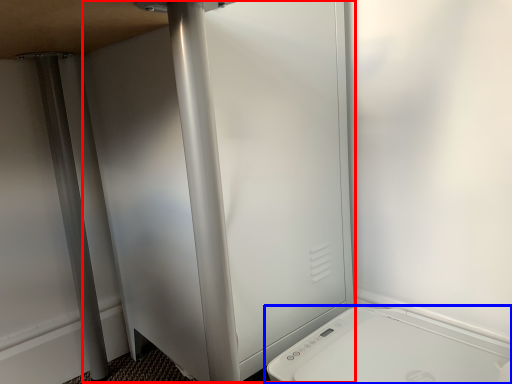
Question: Which object is further to the camera taking this photo, screen door (highlighted by a red box) or home appliance (highlighted by a blue box)?

Choices:
 (A) screen door
 (B) home appliance

Answer: (A)